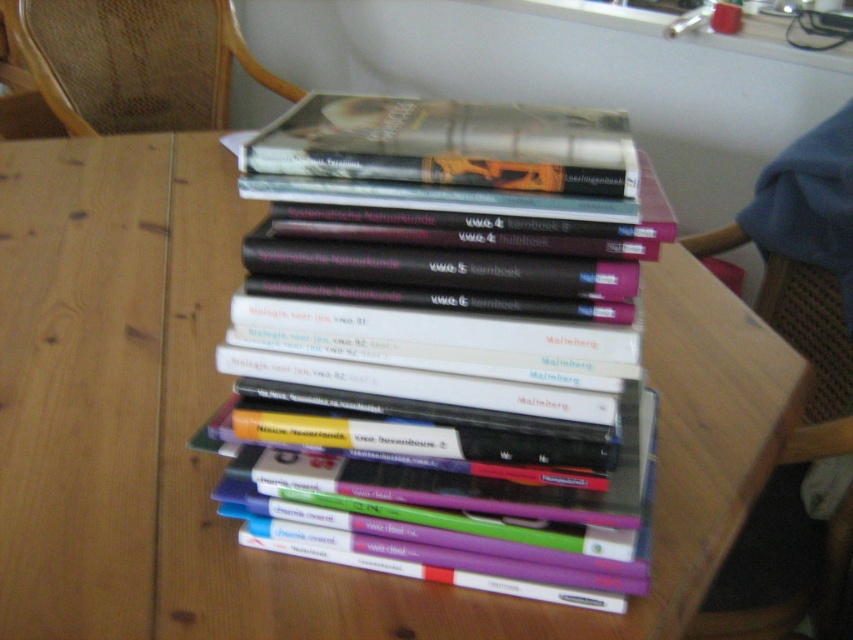
Question: Which point is closer to the camera?

Choices:
 (A) hardcover book at center
 (B) woven cane chair at upper left

Answer: (A)

Question: Does hardcover book at center have a lesser width compared to woven cane chair at upper left?

Choices:
 (A) no
 (B) yes

Answer: (B)

Question: Which of the following is the closest to the observer?

Choices:
 (A) woven cane chair at upper left
 (B) hardcover book at center

Answer: (B)

Question: Is hardcover book at center to the right of woven cane chair at upper left from the viewer's perspective?

Choices:
 (A) yes
 (B) no

Answer: (A)

Question: Is hardcover book at center thinner than woven cane chair at upper left?

Choices:
 (A) yes
 (B) no

Answer: (A)

Question: Which point is farther to the camera?

Choices:
 (A) (572, 364)
 (B) (160, 99)

Answer: (B)